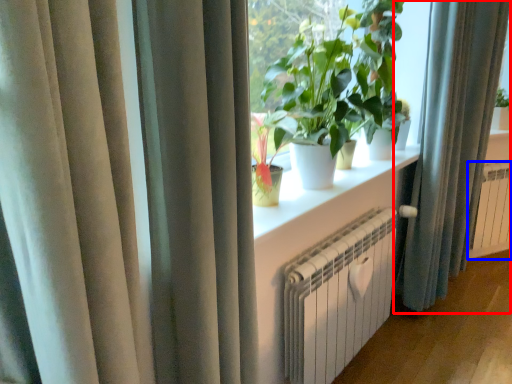
Question: Which of the following is the closest to the observer, curtain (highlighted by a red box) or radiator (highlighted by a blue box)?

Choices:
 (A) curtain
 (B) radiator

Answer: (A)